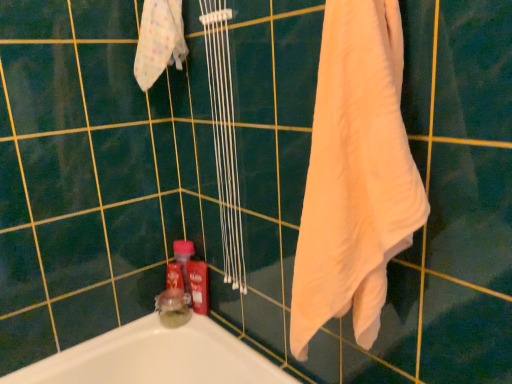
Question: Should I look upward or downward to see red glossy bottle at lower center?

Choices:
 (A) up
 (B) down

Answer: (B)

Question: Is red glossy bottle at lower center inside translucent glass jar at lower left?

Choices:
 (A) yes
 (B) no

Answer: (B)

Question: From the image's perspective, is translucent glass jar at lower left below red glossy bottle at lower center?

Choices:
 (A) yes
 (B) no

Answer: (A)

Question: Does translucent glass jar at lower left lie in front of red glossy bottle at lower center?

Choices:
 (A) yes
 (B) no

Answer: (A)

Question: Is translucent glass jar at lower left to the left of red glossy bottle at lower center from the viewer's perspective?

Choices:
 (A) no
 (B) yes

Answer: (B)

Question: Does translucent glass jar at lower left have a greater height compared to red glossy bottle at lower center?

Choices:
 (A) no
 (B) yes

Answer: (A)

Question: Is the depth of translucent glass jar at lower left greater than that of red glossy bottle at lower center?

Choices:
 (A) yes
 (B) no

Answer: (B)

Question: From the image's perspective, would you say white soft towel at right is shown under white soft cloth at upper left?

Choices:
 (A) no
 (B) yes

Answer: (B)

Question: Are white soft towel at right and white soft cloth at upper left located far from each other?

Choices:
 (A) yes
 (B) no

Answer: (B)

Question: From the image's perspective, does white soft towel at right appear higher than white soft cloth at upper left?

Choices:
 (A) no
 (B) yes

Answer: (A)

Question: From a real-world perspective, is white soft towel at right beneath white soft cloth at upper left?

Choices:
 (A) no
 (B) yes

Answer: (B)

Question: Does white soft towel at right have a greater height compared to white soft cloth at upper left?

Choices:
 (A) yes
 (B) no

Answer: (A)

Question: Is white soft towel at right placed right next to white soft cloth at upper left?

Choices:
 (A) no
 (B) yes

Answer: (A)

Question: From the image's perspective, is red glossy bottle at lower center under white soft towel at right?

Choices:
 (A) yes
 (B) no

Answer: (A)